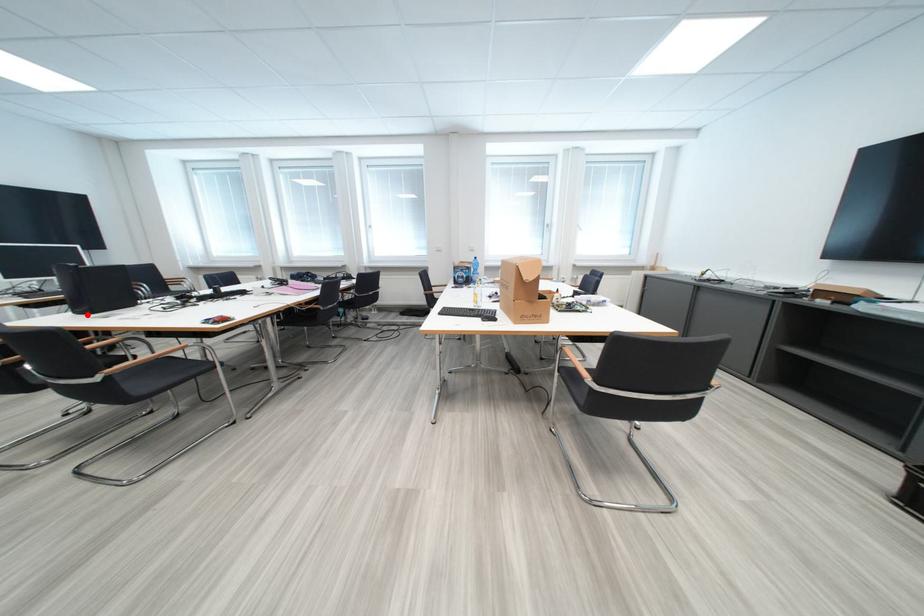
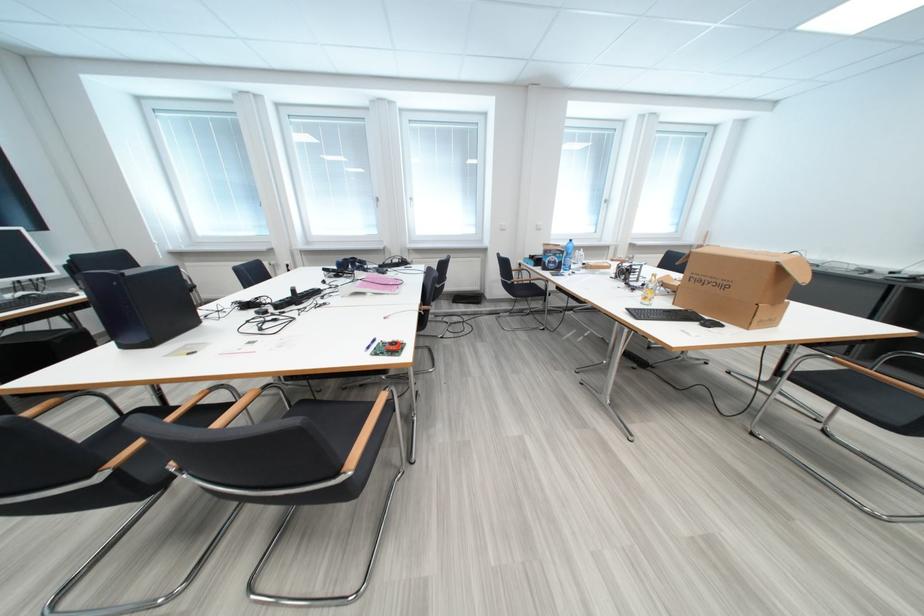
Where in the second image is the point corresponding to the highlighted location from the first image?

(136, 349)